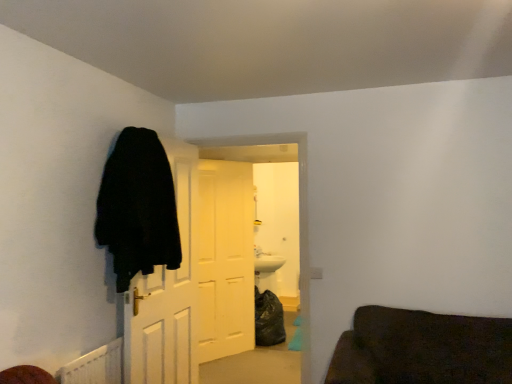
The width and height of the screenshot is (512, 384). In order to click on vacant area situated below white matte door at center, marked as the 3th door in a front-to-back arrangement (from a real-world perspective) in this screenshot , I will do `click(227, 351)`.